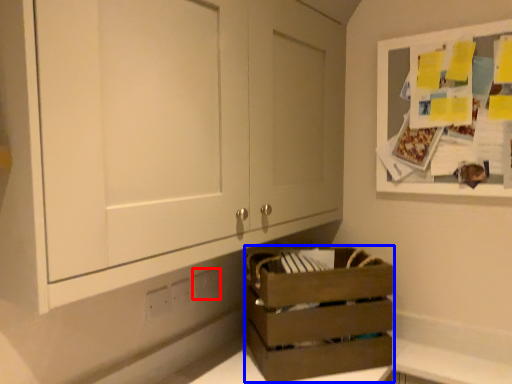
Question: Which of the following is the closest to the observer, electric outlet (highlighted by a red box) or crate (highlighted by a blue box)?

Choices:
 (A) electric outlet
 (B) crate

Answer: (B)